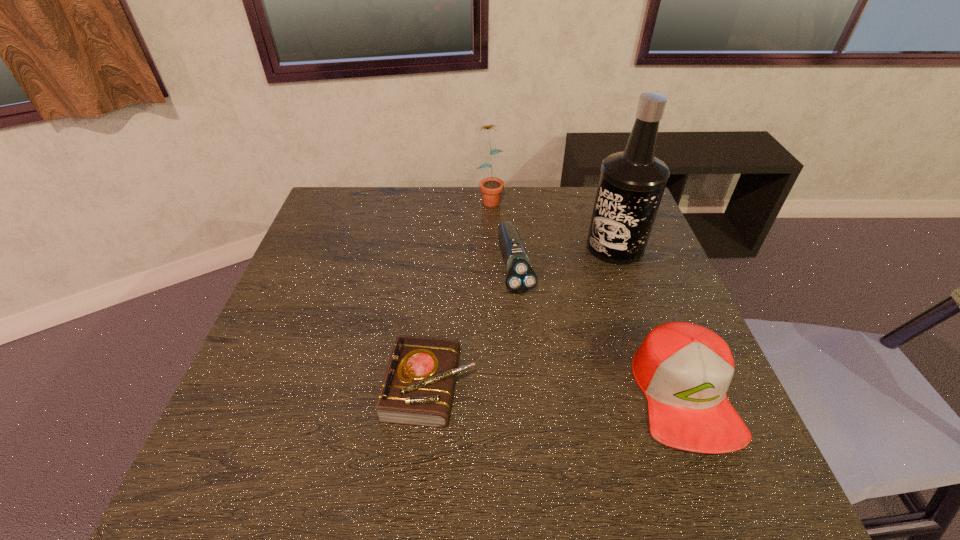
Identify which object is the third closest to the baseball cap. Please provide its 2D coordinates. Your answer should be formatted as a tuple, i.e. [(x, y)], where the tuple contains the x and y coordinates of a point satisfying the conditions above.

[(417, 389)]

Locate an element on the screen. Image resolution: width=960 pixels, height=540 pixels. vacant position in the image that satisfies the following two spatial constraints: 1. on the back side of the second tallest object; 2. on the left side of the diary is located at coordinates (449, 198).